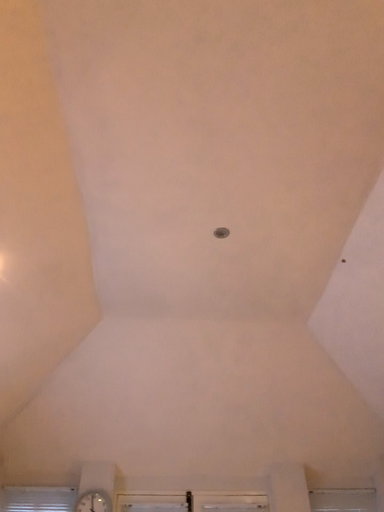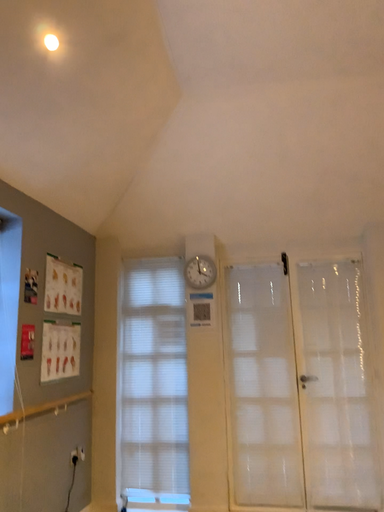
Question: How did the camera likely rotate when shooting the video?

Choices:
 (A) rotated left
 (B) rotated right

Answer: (A)